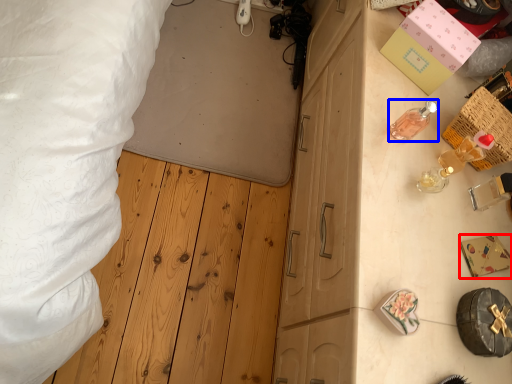
Question: Among these objects, which one is nearest to the camera, box (highlighted by a red box) or toiletry (highlighted by a blue box)?

Choices:
 (A) box
 (B) toiletry

Answer: (B)